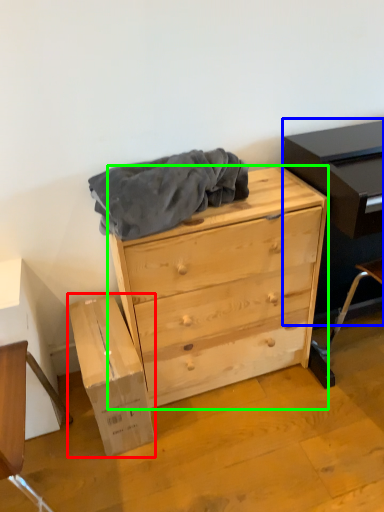
Question: Based on their relative distances, which object is nearer to cardboard box (highlighted by a red box)? Choose from entertainment center (highlighted by a blue box) and chest of drawers (highlighted by a green box).

Choices:
 (A) entertainment center
 (B) chest of drawers

Answer: (B)